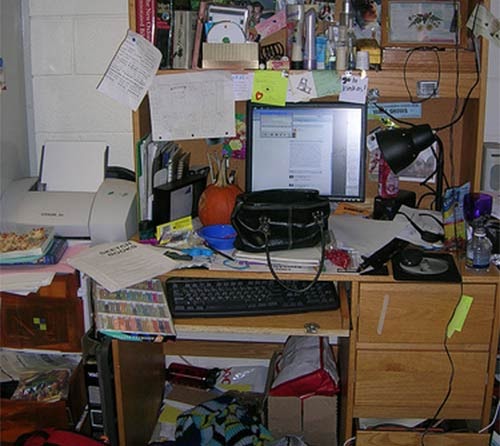
Where is `sticky notes`? The width and height of the screenshot is (500, 446). sticky notes is located at coordinates (272, 91), (298, 94), (353, 84), (330, 83), (247, 86).